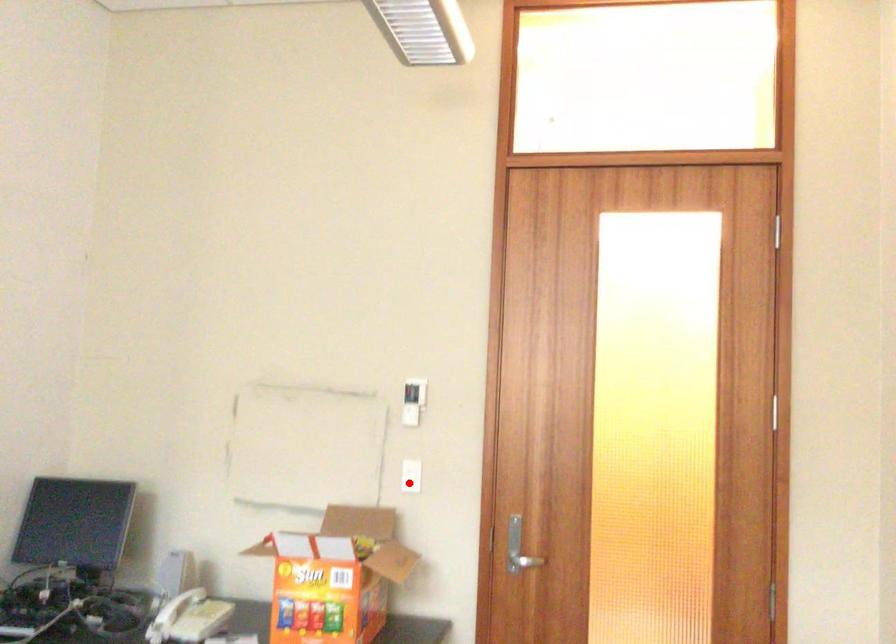
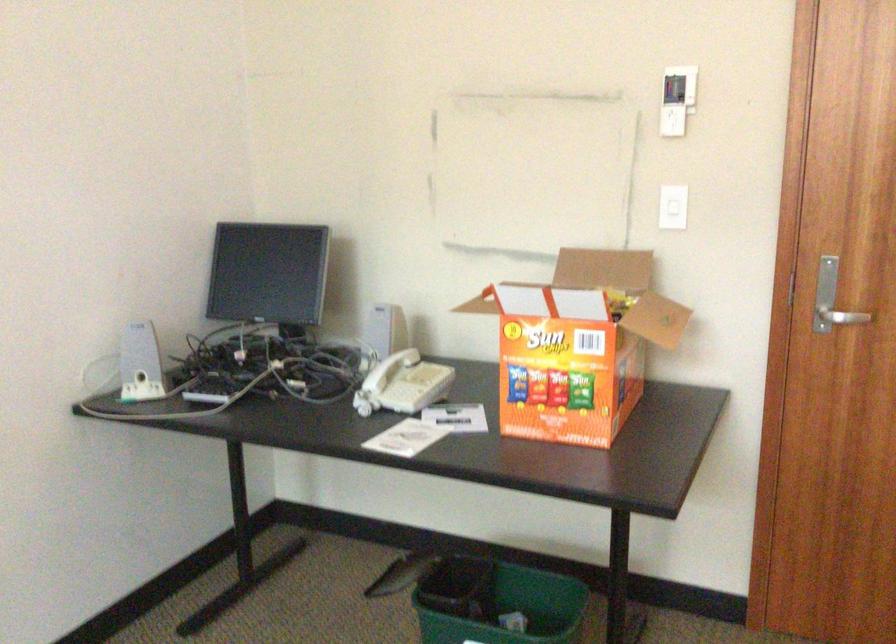
Where in the second image is the point corresponding to the highlighted location from the first image?

(672, 214)